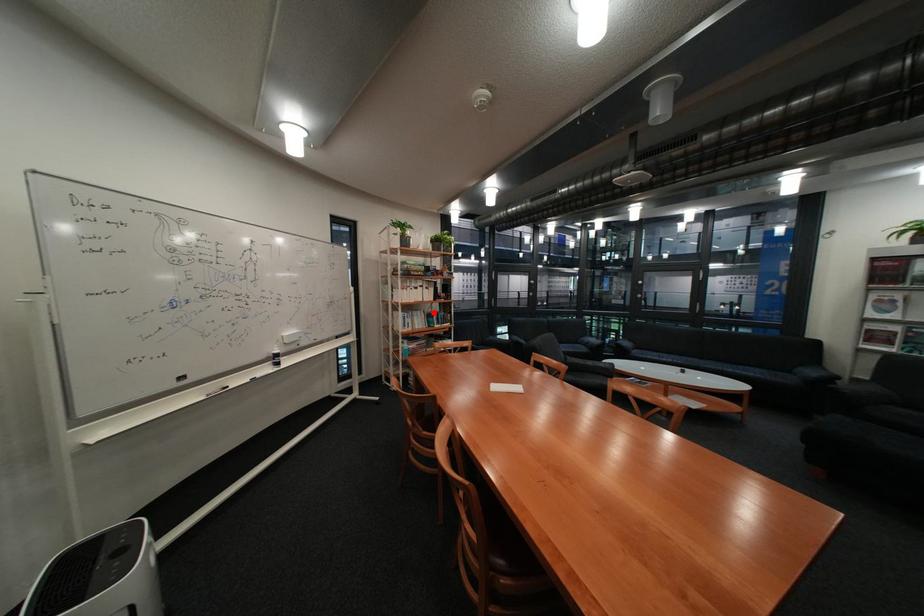
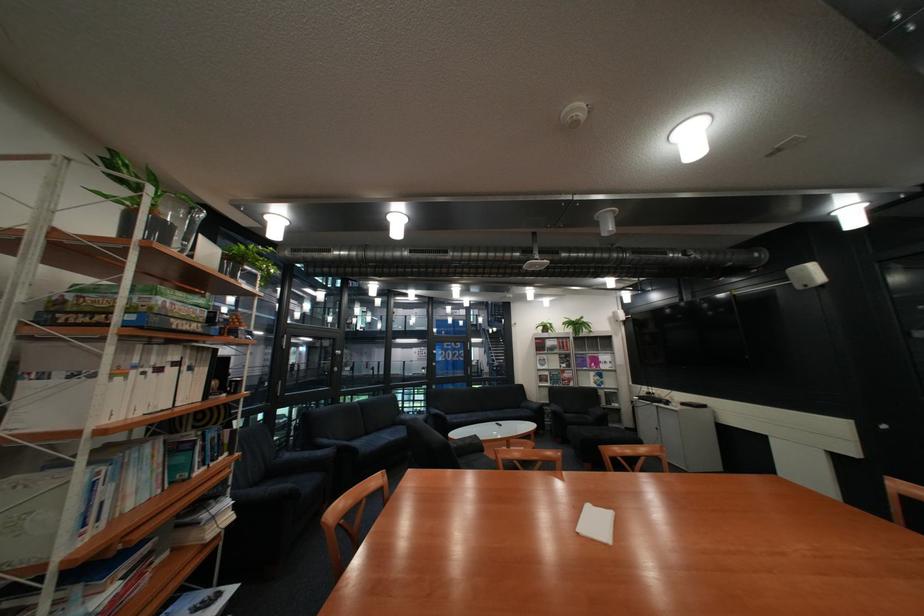
Where in the second image is the point corresponding to the highlighted location from the first image?

(163, 448)